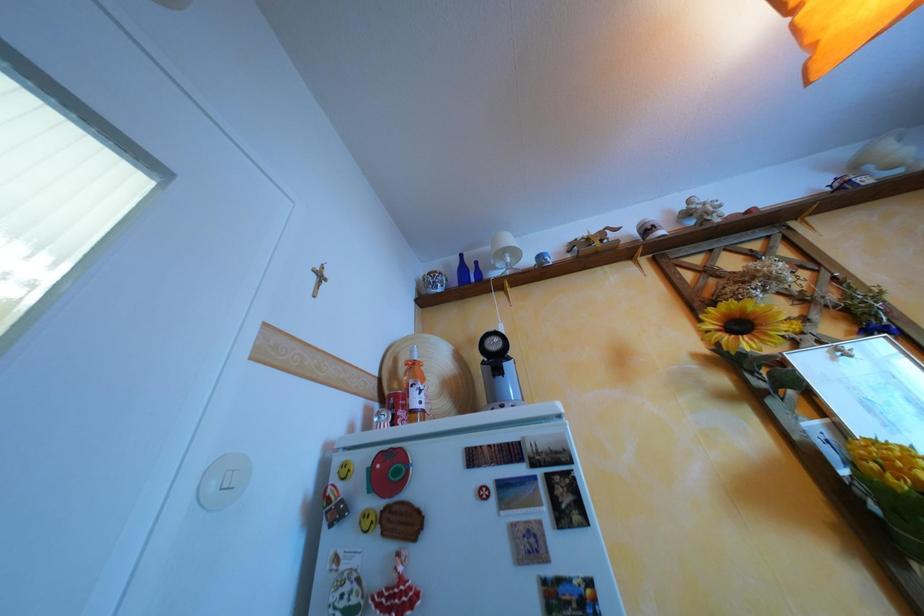
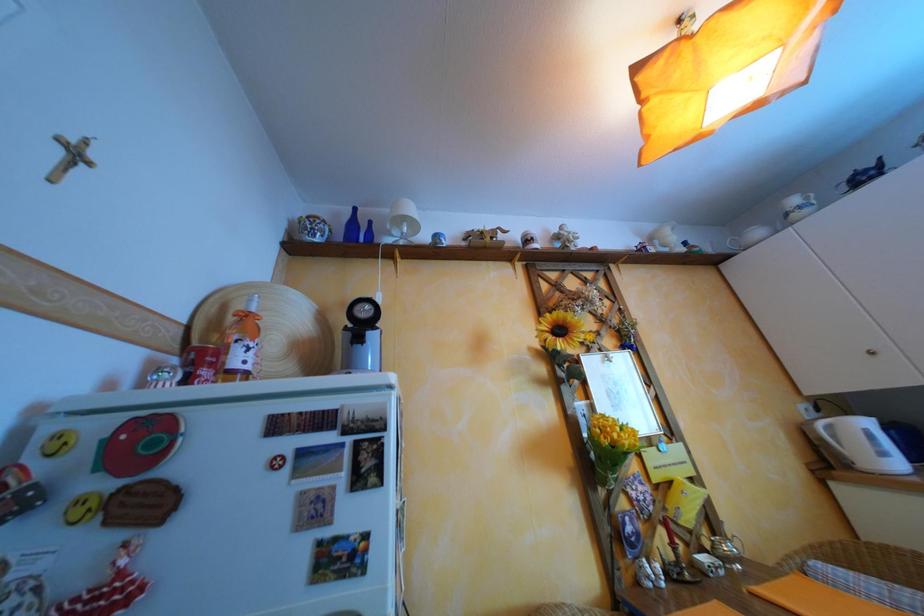
Question: Based on the continuous images, in which direction is the camera rotating? Reply with the corresponding letter.

Choices:
 (A) Left
 (B) Right
 (C) Up
 (D) Down

Answer: (B)